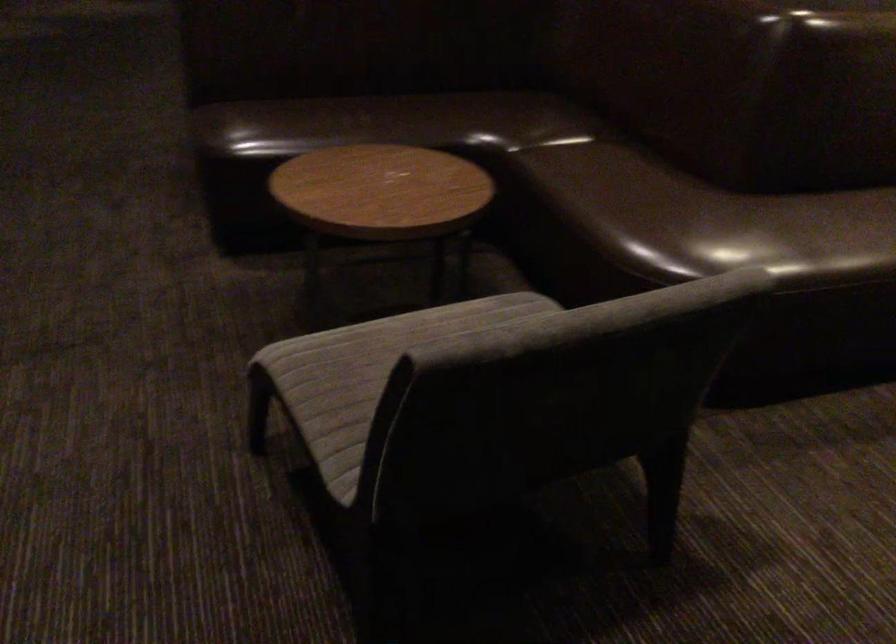
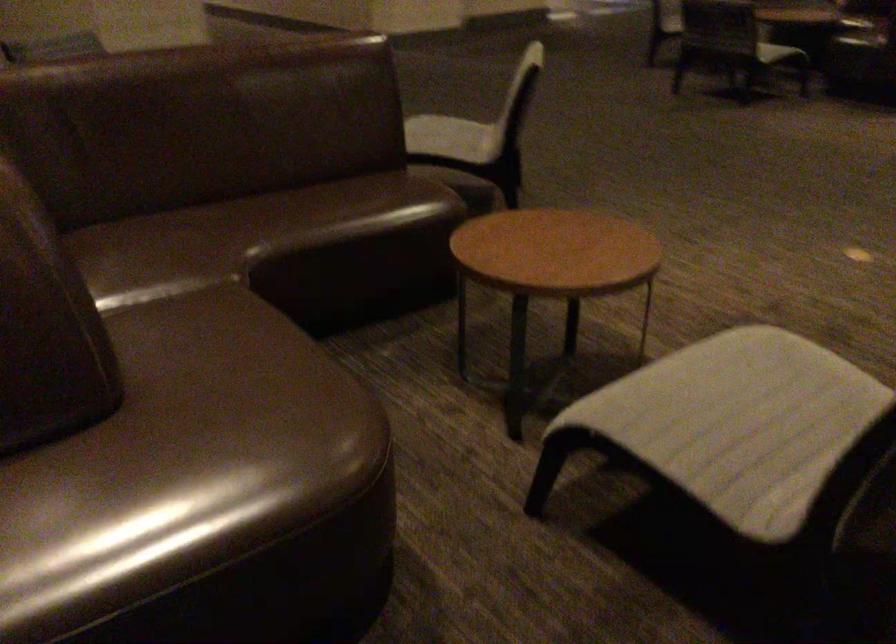
Which direction would the cameraman need to move to produce the second image?

The movement direction of the cameraman is right, forward.